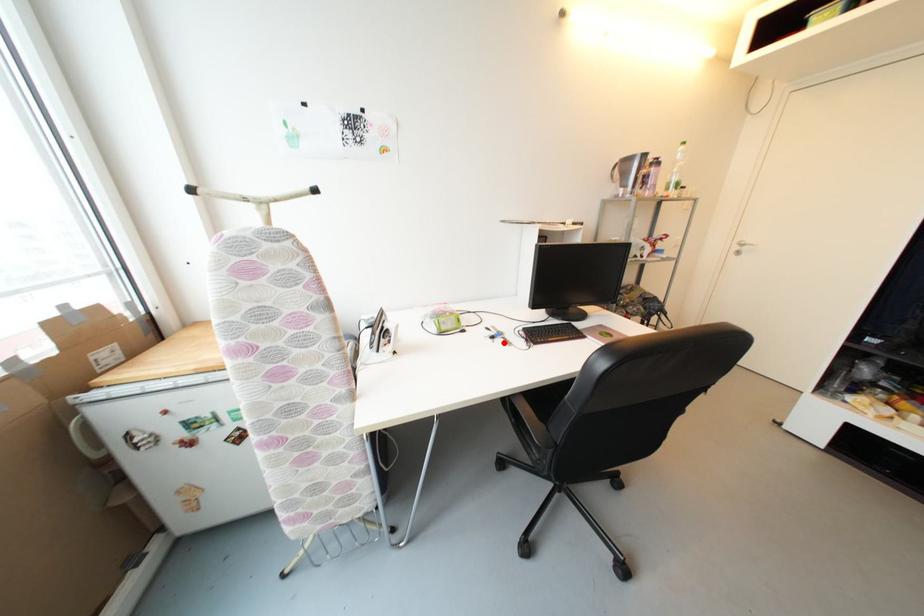
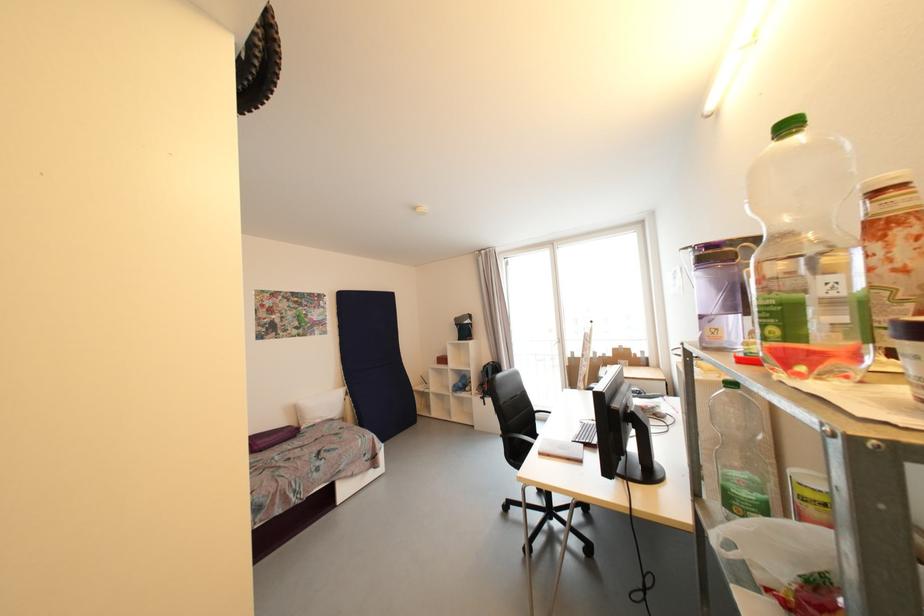
Question: I am providing you with two images of the same scene from different viewpoints. A red point is marked on the first image. At the location where the point appears in image 1, is it still visible in image 2?

Choices:
 (A) Yes
 (B) No

Answer: (B)